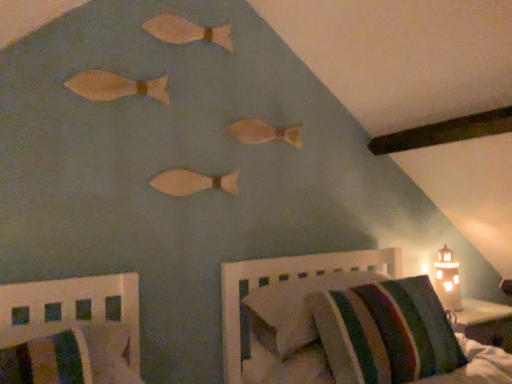
Question: Is striped fabric pillow at lower right taller than striped fabric mattress at lower right?

Choices:
 (A) no
 (B) yes

Answer: (A)

Question: From the image's perspective, does striped fabric pillow at lower right appear lower than striped fabric mattress at lower right?

Choices:
 (A) yes
 (B) no

Answer: (B)

Question: Is striped fabric mattress at lower right at the back of striped fabric pillow at lower right?

Choices:
 (A) no
 (B) yes

Answer: (A)

Question: Does striped fabric pillow at lower right have a smaller size compared to striped fabric mattress at lower right?

Choices:
 (A) yes
 (B) no

Answer: (B)

Question: Does striped fabric pillow at lower right have a larger size compared to striped fabric mattress at lower right?

Choices:
 (A) yes
 (B) no

Answer: (A)

Question: Is striped fabric chair at lower left, arranged as the 2th furniture when viewed from the right, in front of or behind wooden lighthouse at right, positioned as the 2th furniture in left-to-right order, in the image?

Choices:
 (A) behind
 (B) front

Answer: (B)

Question: In terms of width, does striped fabric chair at lower left, which ranks as the 1th furniture in left-to-right order, look wider or thinner when compared to wooden lighthouse at right, which appears as the 1th furniture when viewed from the right?

Choices:
 (A) wide
 (B) thin

Answer: (B)

Question: Is striped fabric chair at lower left, arranged as the 2th furniture when viewed from the right, inside or outside of wooden lighthouse at right, which appears as the 1th furniture when viewed from the right?

Choices:
 (A) inside
 (B) outside

Answer: (B)

Question: In terms of height, does striped fabric chair at lower left, which ranks as the 1th furniture in left-to-right order, look taller or shorter compared to wooden lighthouse at right, which appears as the 1th furniture when viewed from the right?

Choices:
 (A) short
 (B) tall

Answer: (A)

Question: In terms of width, does wooden lighthouse at right, which appears as the 1th furniture when viewed from the right, look wider or thinner when compared to wooden fish at center, the 2th animal ordered from the bottom?

Choices:
 (A) thin
 (B) wide

Answer: (B)

Question: In terms of size, does wooden lighthouse at right, which appears as the 1th furniture when viewed from the right, appear bigger or smaller than wooden fish at center, which is the third animal from top to bottom?

Choices:
 (A) small
 (B) big

Answer: (B)

Question: Which is correct: wooden lighthouse at right, which appears as the 1th furniture when viewed from the right, is inside wooden fish at center, the 2th animal ordered from the bottom, or outside of it?

Choices:
 (A) inside
 (B) outside

Answer: (B)

Question: Visually, is wooden lighthouse at right, positioned as the 2th furniture in left-to-right order, positioned to the left or to the right of wooden fish at center, the 2th animal ordered from the bottom?

Choices:
 (A) left
 (B) right

Answer: (B)

Question: Does point (326, 274) appear closer or farther from the camera than point (32, 307)?

Choices:
 (A) farther
 (B) closer

Answer: (A)

Question: From a real-world perspective, relative to striped fabric chair at lower left, which ranks as the 1th furniture in left-to-right order, is striped fabric pillow at lower right vertically above or below?

Choices:
 (A) below
 (B) above

Answer: (B)